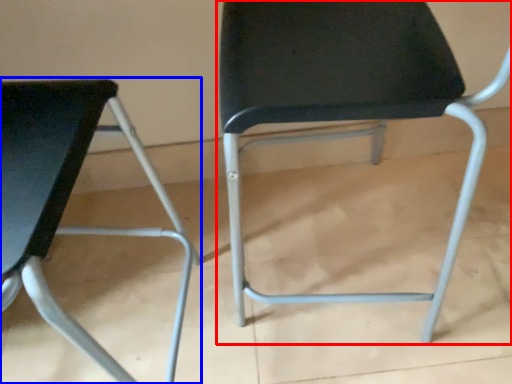
Question: Which object appears closest to the camera in this image, chair (highlighted by a red box) or chair (highlighted by a blue box)?

Choices:
 (A) chair
 (B) chair

Answer: (B)